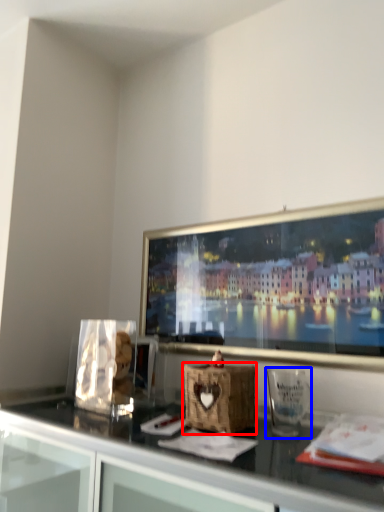
Question: Which object is closer to the camera taking this photo, basket (highlighted by a red box) or glass vase (highlighted by a blue box)?

Choices:
 (A) basket
 (B) glass vase

Answer: (B)